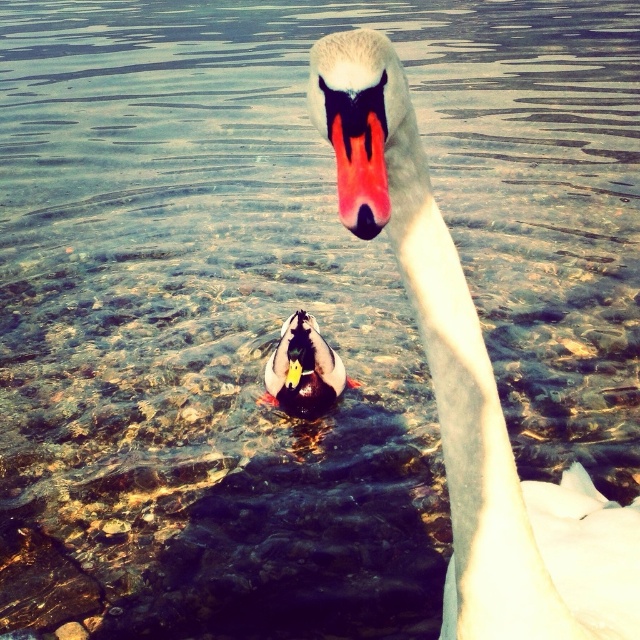
Does shiny multicolored duck at center lie in front of matte black beak at center?

No, shiny multicolored duck at center is further to the viewer.

Who is higher up, shiny multicolored duck at center or matte black beak at center?

Positioned higher is matte black beak at center.

Who is more forward, (298, 324) or (358, 224)?

Positioned in front is point (358, 224).

At what (x,y) coordinates should I click in order to perform the action: click on shiny multicolored duck at center. Please return your answer as a coordinate pair (x, y). Looking at the image, I should click on (304, 369).

Does white glossy swan at upper center lie in front of matte black beak at center?

No, white glossy swan at upper center is behind matte black beak at center.

Which is above, white glossy swan at upper center or matte black beak at center?

Positioned higher is matte black beak at center.

Locate an element on the screen. This screenshot has height=640, width=640. white glossy swan at upper center is located at coordinates (481, 408).

The image size is (640, 640). What do you see at coordinates (481, 408) in the screenshot? I see `white glossy swan at upper center` at bounding box center [481, 408].

This screenshot has width=640, height=640. What are the coordinates of `white glossy swan at upper center` in the screenshot? It's located at (481, 408).